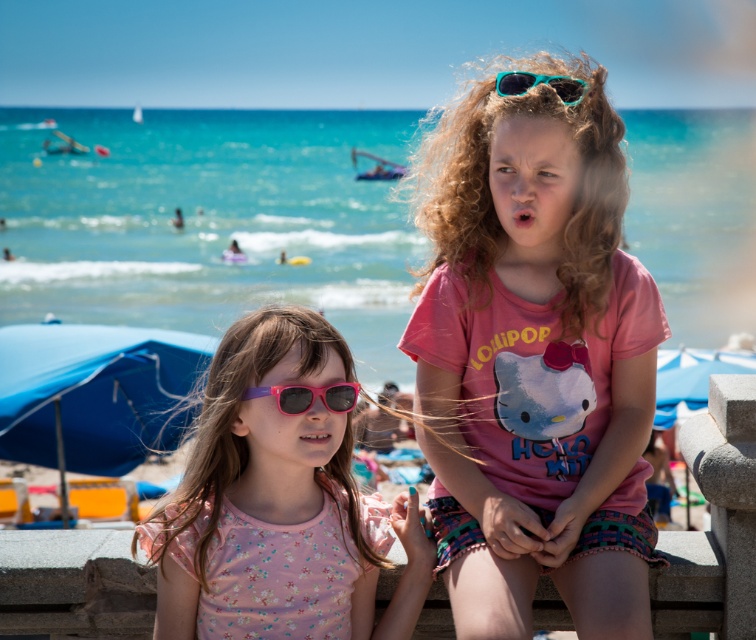
Question: From the image, what is the correct spatial relationship of pink plastic goggles at center in relation to teal plastic goggles at upper center?

Choices:
 (A) left
 (B) right

Answer: (A)

Question: Does pink matte shirt at center appear on the right side of pink matte sunglasses at center?

Choices:
 (A) yes
 (B) no

Answer: (A)

Question: Which object appears farthest from the camera in this image?

Choices:
 (A) pink matte shirt at center
 (B) pink matte sunglasses at center

Answer: (B)

Question: Which object is farther from the camera taking this photo?

Choices:
 (A) teal plastic goggles at upper center
 (B) pink matte sunglasses at center

Answer: (A)

Question: Where is pink plastic goggles at center located in relation to teal plastic goggles at upper center in the image?

Choices:
 (A) right
 (B) left

Answer: (B)

Question: Estimate the real-world distances between objects in this image. Which object is closer to the teal plastic goggles at upper center?

Choices:
 (A) pink plastic goggles at center
 (B) pink matte shirt at center
 (C) pink matte sunglasses at center

Answer: (B)